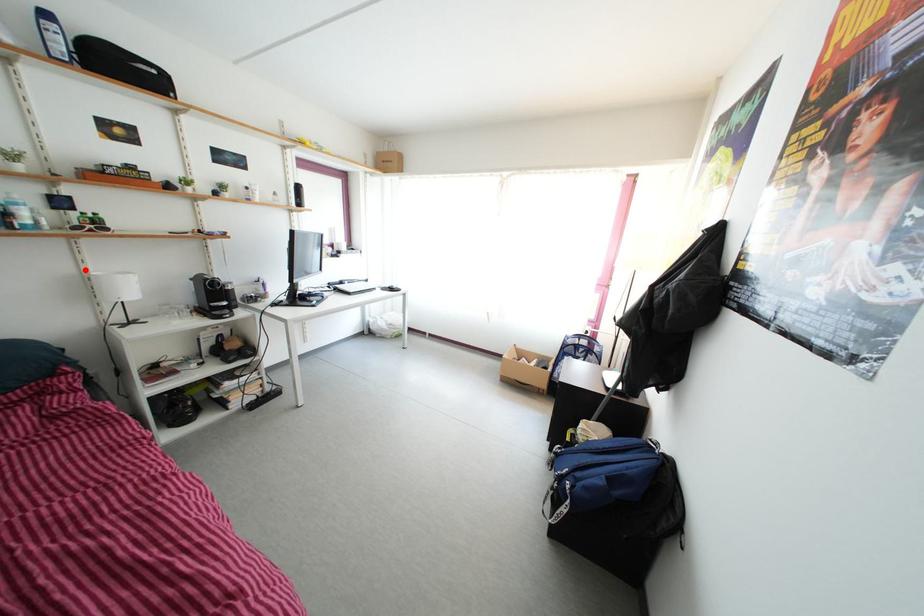
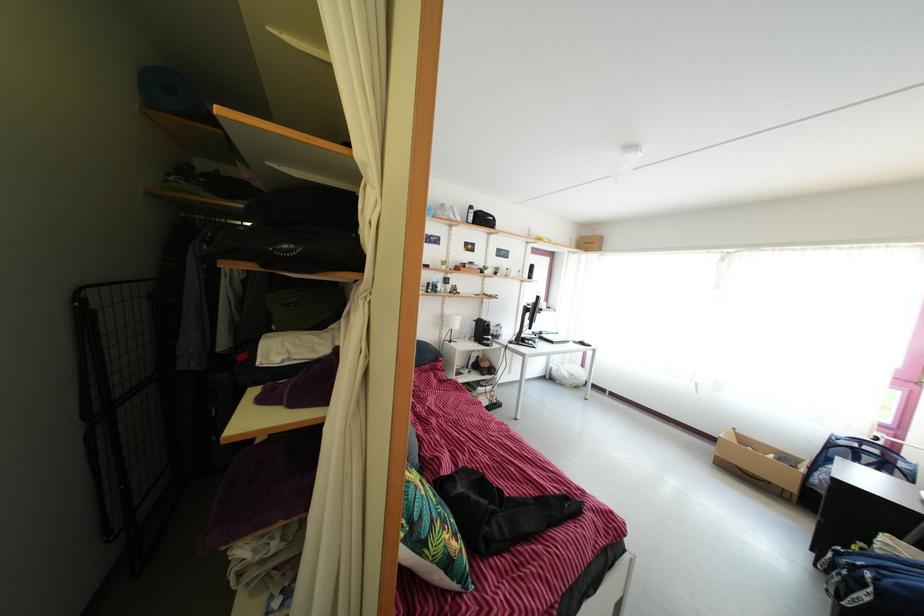
Where in the second image is the point corresponding to the highlighted location from the first image?

(448, 315)